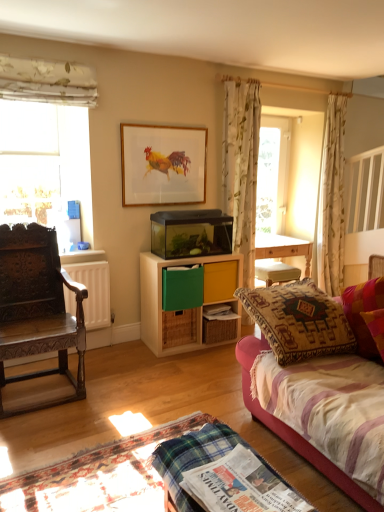
This screenshot has width=384, height=512. Describe the element at coordinates (163, 164) in the screenshot. I see `wooden framed picture of rooster at upper center` at that location.

What do you see at coordinates (292, 429) in the screenshot? This screenshot has width=384, height=512. I see `velvet pink couch at lower right` at bounding box center [292, 429].

What do you see at coordinates (183, 306) in the screenshot? I see `wooden storage unit at center` at bounding box center [183, 306].

Describe the element at coordinates (241, 167) in the screenshot. I see `floral fabric curtain at center, the second curtain in the right-to-left sequence` at that location.

Image resolution: width=384 pixels, height=512 pixels. Describe the element at coordinates (47, 81) in the screenshot. I see `white floral fabric at upper left, which is the 3th curtain in right-to-left order` at that location.

This screenshot has height=512, width=384. I want to click on white floral fabric at upper left, placed as the 3th curtain when sorted from back to front, so click(x=47, y=81).

The height and width of the screenshot is (512, 384). Identify the location of green woven drawer at center, which is the 1th drawer in bottom-to-top order. (179, 328).

What are the coordinates of `pillow that is under the white floral fabric at upper left, which is counted as the 1th curtain, starting from the front (from a real-world perspective)` in the screenshot? It's located at [x=363, y=310].

Is white floral fabric at upper left, which is the 3th curtain in right-to-left order, positioned behind velvet pink pillow at right?

Yes.

Considering the relative positions of green woven drawer at center, which is the 1th drawer in bottom-to-top order, and velvet pink couch at lower right in the image provided, is green woven drawer at center, which is the 1th drawer in bottom-to-top order, to the left of velvet pink couch at lower right from the viewer's perspective?

Yes, green woven drawer at center, which is the 1th drawer in bottom-to-top order, is to the left of velvet pink couch at lower right.

Between green woven drawer at center, which is the 1th drawer in bottom-to-top order, and velvet pink couch at lower right, which one has less height?

With less height is green woven drawer at center, which is the 1th drawer in bottom-to-top order.

From a real-world perspective, relative to velvet pink couch at lower right, is green woven drawer at center, which is the 1th drawer in bottom-to-top order, vertically above or below?

In terms of real-world spatial position, green woven drawer at center, which is the 1th drawer in bottom-to-top order, is below velvet pink couch at lower right.

Between green woven drawer at center, which is counted as the 3th drawer, starting from the top, and velvet pink couch at lower right, which one has smaller size?

Smaller between the two is green woven drawer at center, which is counted as the 3th drawer, starting from the top.

From the image's perspective, which is below, carved wood chair at left or wooden storage unit at center?

From the image's view, carved wood chair at left is below.

Where is `chair lying below the wooden storage unit at center (from the image's perspective)`? chair lying below the wooden storage unit at center (from the image's perspective) is located at coordinates (38, 308).

Which object is thinner, carved wood chair at left or wooden storage unit at center?

Thinner between the two is wooden storage unit at center.

How different are the orientations of carved wood chair at left and wooden storage unit at center in degrees?

3.45 degrees.

Where is `window in front of the green woven drawer at center, which is counted as the 3th drawer, starting from the top`? The image size is (384, 512). window in front of the green woven drawer at center, which is counted as the 3th drawer, starting from the top is located at coordinates (46, 145).

Based on the photo, from the image's perspective, which object appears higher, green woven drawer at center, which is counted as the 3th drawer, starting from the top, or transparent glass window at left?

transparent glass window at left, from the image's perspective.

Between green woven drawer at center, which is the 1th drawer in bottom-to-top order, and transparent glass window at left, which one has smaller width?

transparent glass window at left is thinner.

Is green woven drawer at center, which is the 1th drawer in bottom-to-top order, further to camera compared to transparent glass window at left?

Yes.

Visually, is carved wood chair at left positioned to the left or to the right of transparent glass window at left?

carved wood chair at left is positioned on transparent glass window at left's right side.

From a real-world perspective, who is located lower, carved wood chair at left or transparent glass window at left?

From a 3D spatial view, carved wood chair at left is below.

This screenshot has width=384, height=512. Find the location of `chair on the right of the transparent glass window at left`. chair on the right of the transparent glass window at left is located at coordinates (38, 308).

Are carved wood chair at left and transparent glass window at left making contact?

carved wood chair at left is not next to transparent glass window at left, and they're not touching.

Does wooden storage unit at center turn towards yellow matte drawer at center, which ranks as the third drawer in bottom-to-top order?

Yes, wooden storage unit at center is aimed at yellow matte drawer at center, which ranks as the third drawer in bottom-to-top order.

From a real-world perspective, between wooden storage unit at center and yellow matte drawer at center, which ranks as the third drawer in bottom-to-top order, who is vertically lower?

wooden storage unit at center is physically lower.

Which point is more distant from viewer, (242, 261) or (233, 284)?

The point (242, 261) is farther from the camera.

Who is bigger, green woven drawer at center, which is the 1th drawer in bottom-to-top order, or yellow matte drawer at center, which is the first drawer from top to bottom?

With larger size is yellow matte drawer at center, which is the first drawer from top to bottom.

From the image's perspective, would you say green woven drawer at center, which is the 1th drawer in bottom-to-top order, is positioned over yellow matte drawer at center, which is the first drawer from top to bottom?

No.

Is green woven drawer at center, which is the 1th drawer in bottom-to-top order, facing away from yellow matte drawer at center, which ranks as the third drawer in bottom-to-top order?

No, green woven drawer at center, which is the 1th drawer in bottom-to-top order,'s orientation is not away from yellow matte drawer at center, which ranks as the third drawer in bottom-to-top order.

From a real-world perspective, starting from the velvet pink pillow at right, which curtain is the 3rd one vertically above it? Please provide its 2D coordinates.

[(47, 81)]

Where is `the 2nd drawer behind the velvet pink couch at lower right, counting from the anchor's position`? The height and width of the screenshot is (512, 384). the 2nd drawer behind the velvet pink couch at lower right, counting from the anchor's position is located at coordinates point(179,328).

Which object lies nearer to the anchor point floral fabric curtain at center, which is counted as the second curtain, starting from the front, velvet pink couch at lower right or velvet pink pillow at right?

velvet pink pillow at right is positioned closer to the anchor floral fabric curtain at center, which is counted as the second curtain, starting from the front.

When comparing their distances from white floral curtain at upper right, which is the 3th curtain in left-to-right order, does wooden storage unit at center or wooden framed picture of rooster at upper center seem closer?

wooden storage unit at center.

Looking at the image, which one is located closer to velvet pink couch at lower right, wooden storage unit at center or white floral curtain at upper right, which is the 3th curtain in left-to-right order?

Among the two, wooden storage unit at center is located nearer to velvet pink couch at lower right.

Which object lies further to the anchor point wooden storage unit at center, white floral curtain at upper right, which is the 1th curtain from right to left, or green woven drawer at center, which is the 1th drawer in bottom-to-top order?

white floral curtain at upper right, which is the 1th curtain from right to left, is positioned further to the anchor wooden storage unit at center.

Looking at the image, which one is located further to white floral curtain at upper right, which is the 1th curtain from back to front, wooden storage unit at center or yellow matte drawer at center, which ranks as the third drawer in bottom-to-top order?

The object further to white floral curtain at upper right, which is the 1th curtain from back to front, is wooden storage unit at center.

Looking at the image, which one is located further to white floral fabric at upper left, placed as the 3th curtain when sorted from back to front, velvet pink pillow at right or white floral curtain at upper right, which is the 1th curtain from back to front?

Based on the image, white floral curtain at upper right, which is the 1th curtain from back to front, appears to be further to white floral fabric at upper left, placed as the 3th curtain when sorted from back to front.

Looking at this image, considering their positions, is white floral fabric at upper left, which is the 3th curtain in right-to-left order, positioned further to velvet pink couch at lower right than white floral curtain at upper right, which is the 1th curtain from back to front?

white floral curtain at upper right, which is the 1th curtain from back to front, is further to velvet pink couch at lower right.

Based on their spatial positions, is white floral curtain at upper right, positioned as the 3th curtain in front-to-back order, or green woven drawer at center, which is counted as the 3th drawer, starting from the top, further from floral fabric curtain at center, which is counted as the second curtain, starting from the left?

The object further to floral fabric curtain at center, which is counted as the second curtain, starting from the left, is green woven drawer at center, which is counted as the 3th drawer, starting from the top.

Image resolution: width=384 pixels, height=512 pixels. What are the coordinates of `drawer between velvet pink couch at lower right and wooden framed picture of rooster at upper center from front to back` in the screenshot? It's located at (198, 285).

Where is `cabinetry between velvet pink pillow at right and wooden framed picture of rooster at upper center along the z-axis`? cabinetry between velvet pink pillow at right and wooden framed picture of rooster at upper center along the z-axis is located at coordinates (x=183, y=306).

This screenshot has width=384, height=512. I want to click on cabinetry located between transparent glass window at left and yellow matte drawer at center, which ranks as the third drawer in bottom-to-top order, in the left-right direction, so click(x=183, y=306).

Locate an element on the screen. cabinetry between velvet pink pillow at right and floral fabric curtain at center, which is counted as the second curtain, starting from the front, along the z-axis is located at coordinates (183, 306).